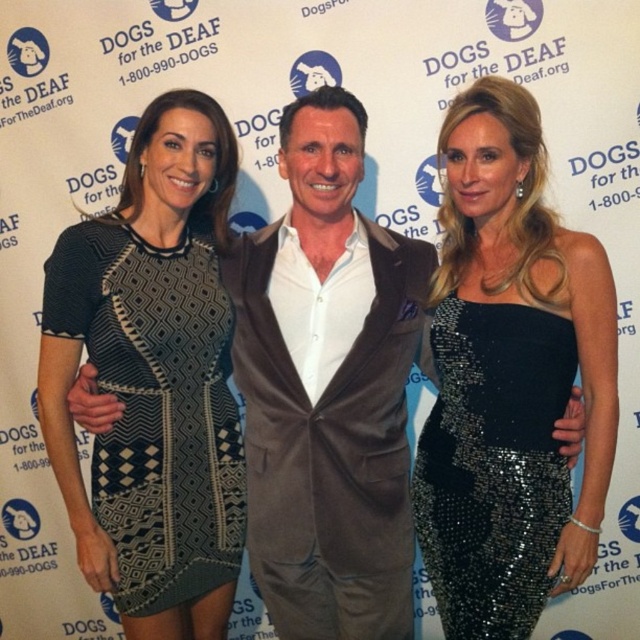
You are a photographer at the event and want to focus on the black sequined dress at center and the matte brown suit at center. Which one should you adjust the camera focus for first to ensure both are in sharp focus?

The black sequined dress at center is closer to the viewer than the matte brown suit at center, so you should focus on the black sequined dress at center first. Once focused, the matte brown suit at center will also come into focus as it is behind the dress.

You are standing in front of the DOGS for the DEAF backdrop and want to place a small decoration between the two points labeled point (444, 397) and point (205, 451). Which point should the decoration be closer to in order to appear closer to the viewer?

The decoration should be placed closer to point (444, 397) because it is closer to the viewer than point (205, 451).